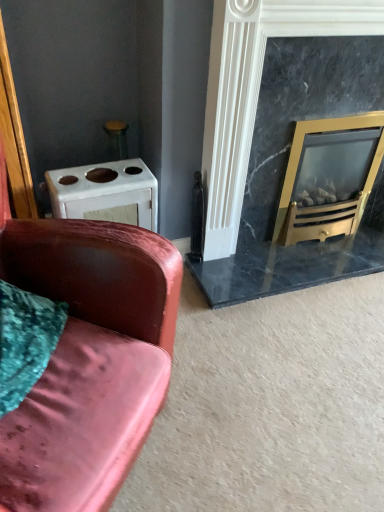
Where is `velvet pink couch at left`? This screenshot has width=384, height=512. velvet pink couch at left is located at coordinates point(88,357).

This screenshot has height=512, width=384. Describe the element at coordinates (293, 143) in the screenshot. I see `marble fireplace at right` at that location.

The height and width of the screenshot is (512, 384). What are the coordinates of `white matte oven at upper left` in the screenshot? It's located at (106, 193).

Where is `velvet pink couch at left`? Image resolution: width=384 pixels, height=512 pixels. velvet pink couch at left is located at coordinates (88, 357).

In the scene shown: What's the angular difference between velvet pink couch at left and marble fireplace at right's facing directions?

The angular difference between velvet pink couch at left and marble fireplace at right is 46.8 degrees.

Considering the sizes of velvet pink couch at left and marble fireplace at right in the image, is velvet pink couch at left taller or shorter than marble fireplace at right?

Clearly, velvet pink couch at left is shorter compared to marble fireplace at right.

Is velvet pink couch at left not close to marble fireplace at right?

Actually, velvet pink couch at left and marble fireplace at right are a little close together.

Which object is positioned more to the left, marble fireplace at right or velvet pink couch at left?

velvet pink couch at left.

Is marble fireplace at right taller or shorter than velvet pink couch at left?

Considering their sizes, marble fireplace at right has more height than velvet pink couch at left.

Is marble fireplace at right positioned with its back to velvet pink couch at left?

marble fireplace at right does not have its back to velvet pink couch at left.

From a real-world perspective, is marble fireplace at right positioned above or below velvet pink couch at left?

From a real-world perspective, marble fireplace at right is physically above velvet pink couch at left.

Is velvet pink couch at left wider than white matte oven at upper left?

Yes.

In the scene shown: From a real-world perspective, who is located lower, velvet pink couch at left or white matte oven at upper left?

From a 3D spatial view, white matte oven at upper left is below.

Measure the distance between velvet pink couch at left and white matte oven at upper left.

velvet pink couch at left and white matte oven at upper left are 20.18 inches apart from each other.

Is white matte oven at upper left at the back of velvet pink couch at left?

No, velvet pink couch at left's orientation is not away from white matte oven at upper left.

Is the surface of marble fireplace at right in direct contact with white matte oven at upper left?

No, marble fireplace at right is not in contact with white matte oven at upper left.

Looking at this image, considering the sizes of objects marble fireplace at right and white matte oven at upper left in the image provided, who is wider, marble fireplace at right or white matte oven at upper left?

white matte oven at upper left.

Does marble fireplace at right have a smaller size compared to white matte oven at upper left?

No, marble fireplace at right is not smaller than white matte oven at upper left.

Which is more to the right, marble fireplace at right or white matte oven at upper left?

marble fireplace at right is more to the right.

Does gold metallic wood burning stove at right have a larger size compared to white matte oven at upper left?

Yes, gold metallic wood burning stove at right is bigger than white matte oven at upper left.

From the picture: Could you tell me if gold metallic wood burning stove at right is turned towards white matte oven at upper left?

No, gold metallic wood burning stove at right is not oriented towards white matte oven at upper left.

From a real-world perspective, is gold metallic wood burning stove at right over white matte oven at upper left?

Yes, from a real-world perspective, gold metallic wood burning stove at right is over white matte oven at upper left

Are gold metallic wood burning stove at right and white matte oven at upper left making contact?

No, gold metallic wood burning stove at right is not beside white matte oven at upper left.

From the image's perspective, is gold metallic wood burning stove at right located above velvet pink couch at left?

Yes.

Can you confirm if gold metallic wood burning stove at right is shorter than velvet pink couch at left?

Yes, gold metallic wood burning stove at right is shorter than velvet pink couch at left.

In the scene shown: How many degrees apart are the facing directions of gold metallic wood burning stove at right and velvet pink couch at left?

46.8 degrees.

Does white matte oven at upper left have a lesser width compared to gold metallic wood burning stove at right?

Yes.

In the scene shown: Between white matte oven at upper left and gold metallic wood burning stove at right, which one is positioned in front?

white matte oven at upper left is more forward.

Between point (156, 210) and point (324, 123), which one is positioned in front?

The point (324, 123) is closer to the camera.

Image resolution: width=384 pixels, height=512 pixels. I want to click on fireplace lying on the right of velvet pink couch at left, so click(293, 143).

The width and height of the screenshot is (384, 512). I want to click on studio couch on the left of marble fireplace at right, so click(88, 357).

Considering their positions, is white matte oven at upper left positioned further to marble fireplace at right than gold metallic wood burning stove at right?

The object further to marble fireplace at right is white matte oven at upper left.

Which object lies nearer to the anchor point marble fireplace at right, gold metallic wood burning stove at right or white matte oven at upper left?

Among the two, gold metallic wood burning stove at right is located nearer to marble fireplace at right.

When comparing their distances from marble fireplace at right, does velvet pink couch at left or gold metallic wood burning stove at right seem closer?

Based on the image, gold metallic wood burning stove at right appears to be nearer to marble fireplace at right.

Estimate the real-world distances between objects in this image. Which object is closer to white matte oven at upper left, velvet pink couch at left or marble fireplace at right?

velvet pink couch at left is closer to white matte oven at upper left.

When comparing their distances from white matte oven at upper left, does gold metallic wood burning stove at right or marble fireplace at right seem closer?

marble fireplace at right is closer to white matte oven at upper left.

When comparing their distances from gold metallic wood burning stove at right, does white matte oven at upper left or velvet pink couch at left seem further?

velvet pink couch at left lies further to gold metallic wood burning stove at right than the other object.

From the image, which object appears to be farther from velvet pink couch at left, white matte oven at upper left or marble fireplace at right?

Among the two, marble fireplace at right is located further to velvet pink couch at left.

When comparing their distances from marble fireplace at right, does white matte oven at upper left or velvet pink couch at left seem closer?

white matte oven at upper left is closer to marble fireplace at right.

You are a GUI agent. You are given a task and a screenshot of the screen. Output one action in this format:
    pyautogui.click(x=<x>, y=<y>)
    Task: Click on the fireplace situated between white matte oven at upper left and gold metallic wood burning stove at right from left to right
    This screenshot has height=512, width=384.
    Given the screenshot: What is the action you would take?
    pyautogui.click(x=293, y=143)

The width and height of the screenshot is (384, 512). In order to click on appliance situated between velvet pink couch at left and marble fireplace at right from left to right in this screenshot , I will do `click(106, 193)`.

Image resolution: width=384 pixels, height=512 pixels. What are the coordinates of `fireplace between velvet pink couch at left and gold metallic wood burning stove at right from front to back` in the screenshot? It's located at (293, 143).

The height and width of the screenshot is (512, 384). Identify the location of appliance located between velvet pink couch at left and gold metallic wood burning stove at right in the depth direction. (106, 193).